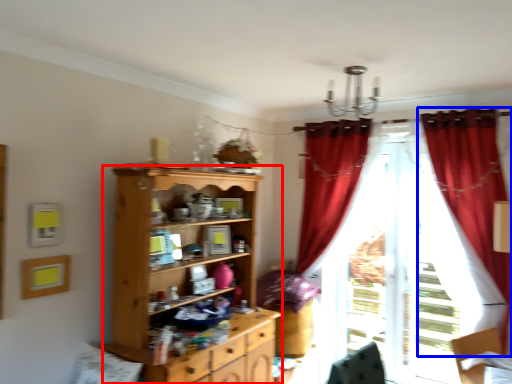
Question: Which point is further to the camera, cupboard (highlighted by a red box) or curtain (highlighted by a blue box)?

Choices:
 (A) cupboard
 (B) curtain

Answer: (B)